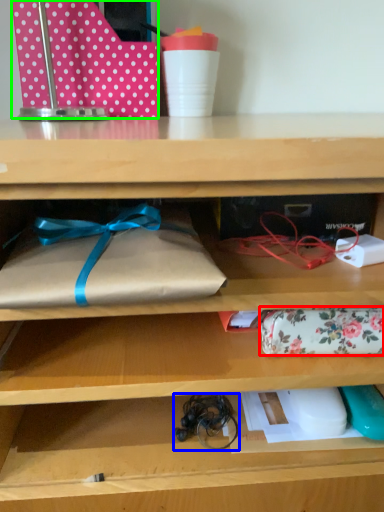
Question: Which object is the closest to the wrap (highlighted by a red box)? Choose among these: twine (highlighted by a blue box) or wrapping paper (highlighted by a green box).

Choices:
 (A) twine
 (B) wrapping paper

Answer: (A)